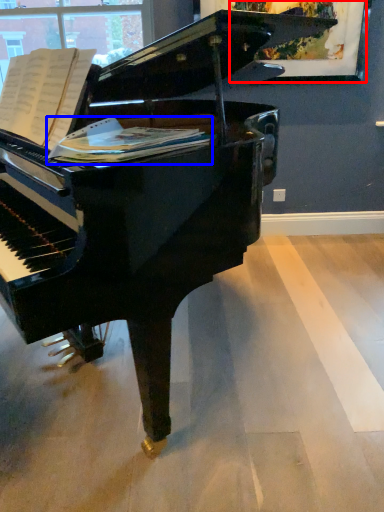
Question: Which point is further to the camera, picture frame (highlighted by a red box) or sheet music (highlighted by a blue box)?

Choices:
 (A) picture frame
 (B) sheet music

Answer: (A)